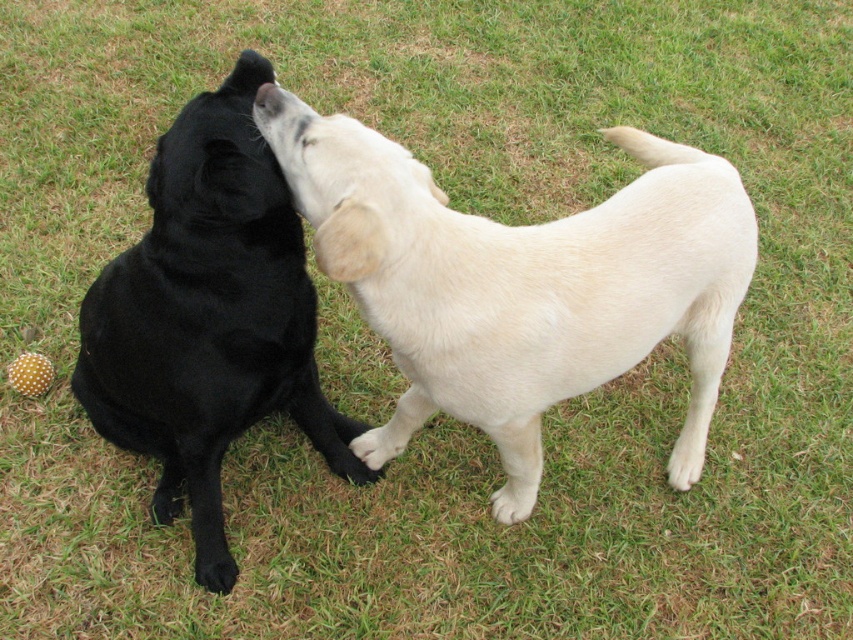
Question: Does shiny white dog at center have a larger size compared to black matte dog at center?

Choices:
 (A) yes
 (B) no

Answer: (A)

Question: Which of the following is the farthest from the observer?

Choices:
 (A) (672, 298)
 (B) (219, 456)

Answer: (B)

Question: Does shiny white dog at center come in front of black matte dog at center?

Choices:
 (A) yes
 (B) no

Answer: (A)

Question: Is shiny white dog at center positioned before black matte dog at center?

Choices:
 (A) no
 (B) yes

Answer: (B)

Question: Which point is closer to the camera?

Choices:
 (A) (256, 301)
 (B) (335, 180)

Answer: (B)